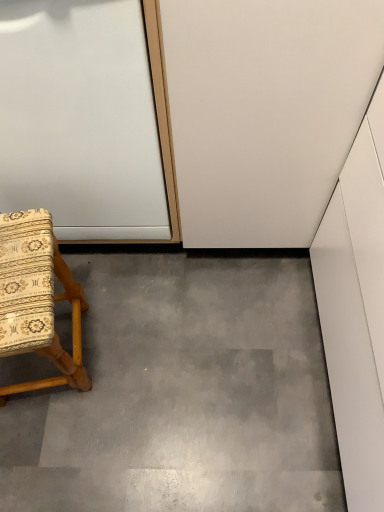
Question: Does white glossy door at upper left have a greater height compared to wooden-patterned fabric chair at lower left?

Choices:
 (A) yes
 (B) no

Answer: (A)

Question: Does white glossy door at upper left have a greater width compared to wooden-patterned fabric chair at lower left?

Choices:
 (A) no
 (B) yes

Answer: (B)

Question: Is white glossy door at upper left thinner than wooden-patterned fabric chair at lower left?

Choices:
 (A) yes
 (B) no

Answer: (B)

Question: From a real-world perspective, is white glossy door at upper left over wooden-patterned fabric chair at lower left?

Choices:
 (A) yes
 (B) no

Answer: (A)

Question: Is white glossy door at upper left in front of wooden-patterned fabric chair at lower left?

Choices:
 (A) no
 (B) yes

Answer: (B)

Question: Does point (0, 42) appear closer or farther from the camera than point (142, 297)?

Choices:
 (A) farther
 (B) closer

Answer: (B)

Question: Considering the positions of white glossy door at upper left and gray concrete at lower left in the image, is white glossy door at upper left wider or thinner than gray concrete at lower left?

Choices:
 (A) wide
 (B) thin

Answer: (B)

Question: Considering the relative positions of white glossy door at upper left and gray concrete at lower left in the image provided, is white glossy door at upper left to the left or to the right of gray concrete at lower left?

Choices:
 (A) right
 (B) left

Answer: (B)

Question: From a real-world perspective, is white glossy door at upper left physically located above or below gray concrete at lower left?

Choices:
 (A) below
 (B) above

Answer: (B)

Question: From a real-world perspective, is gray concrete at lower left physically located above or below white glossy door at upper left?

Choices:
 (A) below
 (B) above

Answer: (A)

Question: Is gray concrete at lower left wider or thinner than white glossy door at upper left?

Choices:
 (A) thin
 (B) wide

Answer: (B)

Question: Would you say gray concrete at lower left is inside or outside white glossy door at upper left?

Choices:
 (A) outside
 (B) inside

Answer: (A)

Question: Considering the positions of gray concrete at lower left and white glossy door at upper left in the image, is gray concrete at lower left taller or shorter than white glossy door at upper left?

Choices:
 (A) short
 (B) tall

Answer: (A)

Question: From a real-world perspective, is gray concrete at lower left above or below wooden-patterned fabric chair at lower left?

Choices:
 (A) below
 (B) above

Answer: (A)

Question: Based on their sizes in the image, would you say gray concrete at lower left is bigger or smaller than wooden-patterned fabric chair at lower left?

Choices:
 (A) small
 (B) big

Answer: (A)